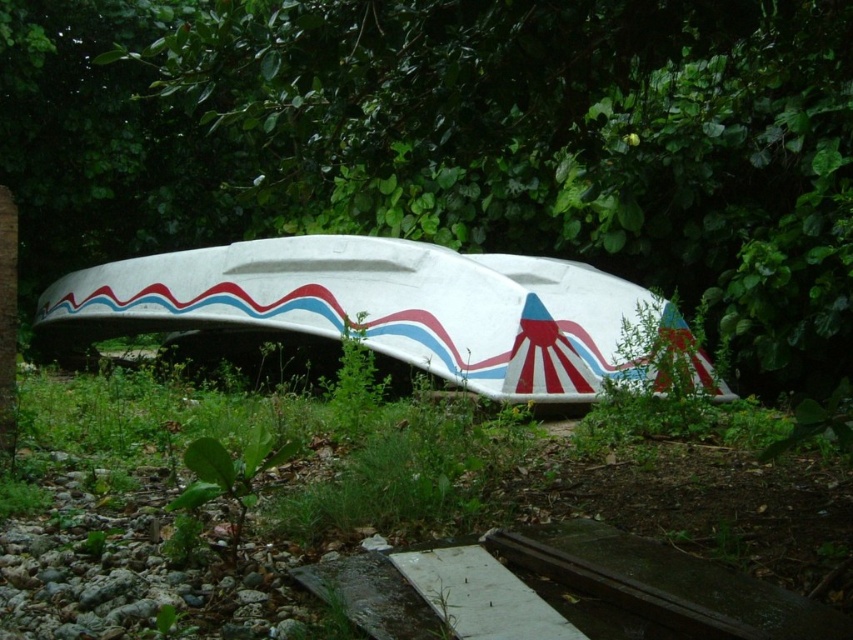
Who is higher up, green leafy tree at center or white glossy boat at center?

green leafy tree at center is higher up.

Can you confirm if green leafy tree at center is shorter than white glossy boat at center?

No.

What are the coordinates of `green leafy tree at center` in the screenshot? It's located at (457, 141).

You are a GUI agent. You are given a task and a screenshot of the screen. Output one action in this format:
    pyautogui.click(x=<x>, y=<y>)
    Task: Click on the green leafy tree at center
    
    Given the screenshot: What is the action you would take?
    pyautogui.click(x=457, y=141)